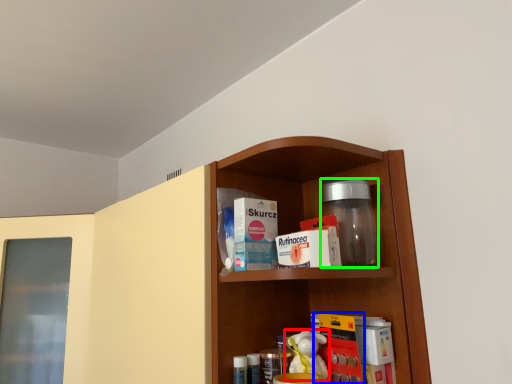
Question: Which object is positioned closest to toy (highlighted by a red box)? Select from book (highlighted by a blue box) and glass jar (highlighted by a green box).

Choices:
 (A) book
 (B) glass jar

Answer: (A)